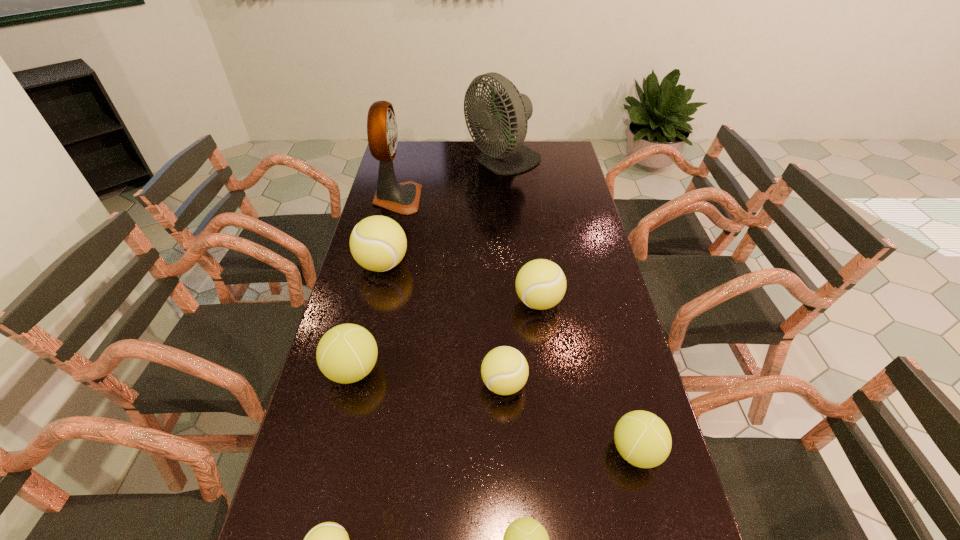
The height and width of the screenshot is (540, 960). What are the coordinates of `green tennis ball that is the closest to the second green tennis ball from right to left` in the screenshot? It's located at (643, 439).

You are a GUI agent. You are given a task and a screenshot of the screen. Output one action in this format:
    pyautogui.click(x=<x>, y=<y>)
    Task: Click on the second closest green tennis ball to the nearest green tennis ball
    The height and width of the screenshot is (540, 960).
    Given the screenshot: What is the action you would take?
    pyautogui.click(x=347, y=353)

Identify the location of blank area in the image that satisfies the following two spatial constraints: 1. on the front-facing side of the rightmost object; 2. on the right side of the left fan. (337, 451).

I want to click on free spot that satisfies the following two spatial constraints: 1. on the back side of the biggest yellow tennis ball; 2. on the front-facing side of the left fan, so click(398, 199).

Identify the location of free space that satisfies the following two spatial constraints: 1. on the front-facing side of the seventh shortest object; 2. on the right side of the left fan. The width and height of the screenshot is (960, 540). (381, 265).

Identify the location of vacant area that satisfies the following two spatial constraints: 1. in front of the gray fan to direct airflow; 2. on the back side of the third smallest yellow tennis ball. The width and height of the screenshot is (960, 540). (514, 302).